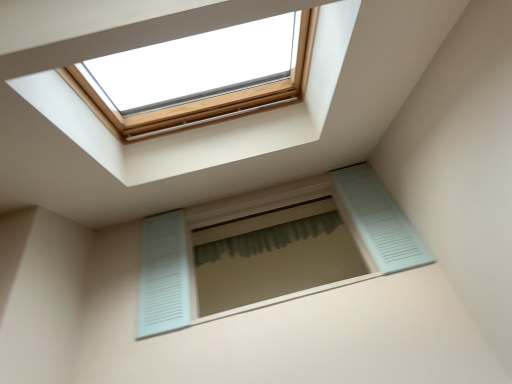
Question: Is light blue louvered window at center spatially inside green fabric shower curtain at center, or outside of it?

Choices:
 (A) inside
 (B) outside

Answer: (B)

Question: Considering the positions of light blue louvered window at center and green fabric shower curtain at center in the image, is light blue louvered window at center wider or thinner than green fabric shower curtain at center?

Choices:
 (A) wide
 (B) thin

Answer: (A)

Question: Is light blue louvered window at center to the left or to the right of green fabric shower curtain at center in the image?

Choices:
 (A) right
 (B) left

Answer: (B)

Question: From a real-world perspective, is green fabric shower curtain at center physically located above or below light blue louvered window at center?

Choices:
 (A) below
 (B) above

Answer: (B)

Question: In terms of height, does green fabric shower curtain at center look taller or shorter compared to light blue louvered window at center?

Choices:
 (A) tall
 (B) short

Answer: (B)

Question: In terms of width, does green fabric shower curtain at center look wider or thinner when compared to light blue louvered window at center?

Choices:
 (A) thin
 (B) wide

Answer: (A)

Question: From the image's perspective, is green fabric shower curtain at center above or below light blue louvered window at center?

Choices:
 (A) below
 (B) above

Answer: (B)